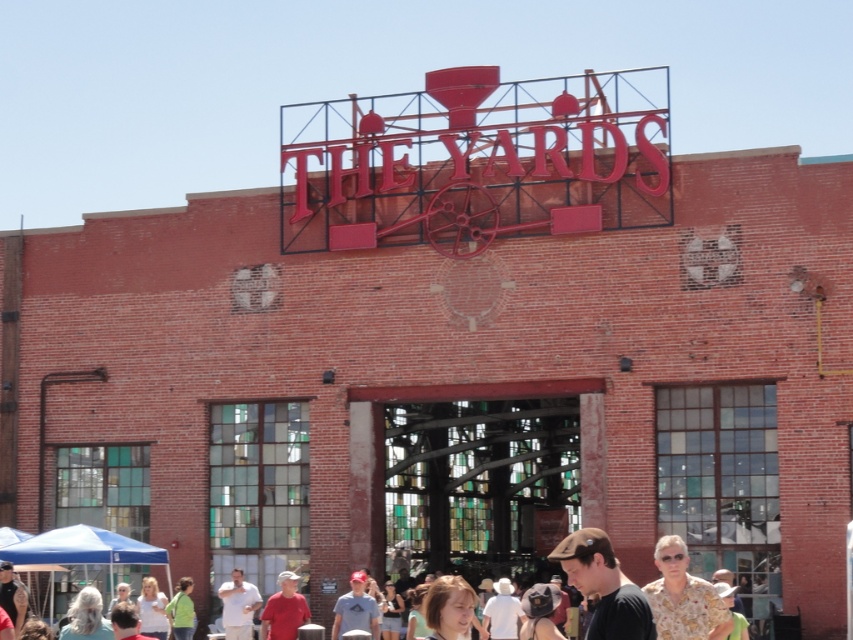
Which is in front, point (589, 548) or point (698, 609)?

Point (589, 548)

Can you confirm if brown cap at lower center is wider than floral shirt at lower right?

Incorrect, brown cap at lower center's width does not surpass floral shirt at lower right's.

Does point (625, 600) lie in front of point (715, 628)?

Yes, point (625, 600) is closer to viewer.

You are a GUI agent. You are given a task and a screenshot of the screen. Output one action in this format:
    pyautogui.click(x=<x>, y=<y>)
    Task: Click on the brown cap at lower center
    The height and width of the screenshot is (640, 853).
    Given the screenshot: What is the action you would take?
    pyautogui.click(x=604, y=586)

Does brown fabric shirt at lower center have a smaller size compared to matte gray cap at center?

No, brown fabric shirt at lower center is not smaller than matte gray cap at center.

Is the position of brown fabric shirt at lower center less distant than that of matte gray cap at center?

Yes.

Where is `brown fabric shirt at lower center`? This screenshot has width=853, height=640. brown fabric shirt at lower center is located at coordinates (61, 547).

Is floral shirt at lower right smaller than matte gray cap at center?

No, floral shirt at lower right is not smaller than matte gray cap at center.

Consider the image. Which of these two, floral shirt at lower right or matte gray cap at center, stands shorter?

With less height is matte gray cap at center.

Which is behind, point (666, 621) or point (357, 582)?

Positioned behind is point (357, 582).

This screenshot has width=853, height=640. In order to click on floral shirt at lower right in this screenshot , I will do `click(683, 596)`.